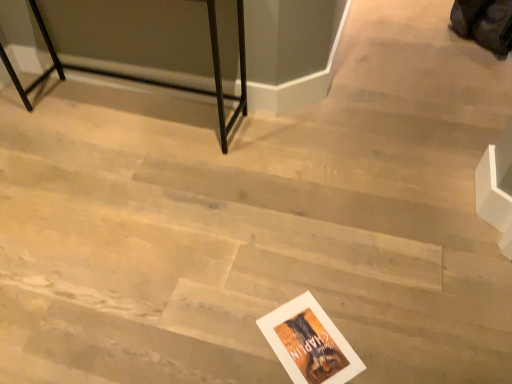
I want to click on white paper postcard at lower center, so click(309, 343).

The height and width of the screenshot is (384, 512). What do you see at coordinates (309, 343) in the screenshot? I see `white paper postcard at lower center` at bounding box center [309, 343].

The image size is (512, 384). Describe the element at coordinates (152, 79) in the screenshot. I see `black metal table at upper left` at that location.

Where is `black metal table at upper left`? black metal table at upper left is located at coordinates 152,79.

Where is `white paper postcard at lower center`? This screenshot has height=384, width=512. white paper postcard at lower center is located at coordinates (309, 343).

Which object is positioned more to the left, white paper postcard at lower center or black metal table at upper left?

black metal table at upper left.

Which object is closer to the camera, white paper postcard at lower center or black metal table at upper left?

white paper postcard at lower center is more forward.

Is point (309, 333) behind point (35, 2)?

No.

From the image's perspective, is white paper postcard at lower center on black metal table at upper left?

No, from the image's perspective, white paper postcard at lower center is not above black metal table at upper left.

From a real-world perspective, between white paper postcard at lower center and black metal table at upper left, who is vertically lower?

In real-world perspective, white paper postcard at lower center is lower.

Between white paper postcard at lower center and black metal table at upper left, which one has larger width?

Wider between the two is black metal table at upper left.

Does white paper postcard at lower center have a greater height compared to black metal table at upper left?

No.

Which of these two, white paper postcard at lower center or black metal table at upper left, is smaller?

white paper postcard at lower center.

Is white paper postcard at lower center completely or partially outside of black metal table at upper left?

Indeed, white paper postcard at lower center is completely outside black metal table at upper left.

Is white paper postcard at lower center not near black metal table at upper left?

Yes, white paper postcard at lower center and black metal table at upper left are quite far apart.

Is white paper postcard at lower center facing towards black metal table at upper left?

No.

How many degrees apart are the facing directions of white paper postcard at lower center and black metal table at upper left?

The angular difference between white paper postcard at lower center and black metal table at upper left is 134 degrees.

Locate an element on the screen. The height and width of the screenshot is (384, 512). postcard on the right of black metal table at upper left is located at coordinates (309, 343).

Consider the image. Considering the relative positions of black metal table at upper left and white paper postcard at lower center in the image provided, is black metal table at upper left to the left of white paper postcard at lower center from the viewer's perspective?

Yes, black metal table at upper left is to the left of white paper postcard at lower center.

Is the position of black metal table at upper left less distant than that of white paper postcard at lower center?

No, black metal table at upper left is behind white paper postcard at lower center.

Does point (209, 12) come farther from viewer compared to point (268, 320)?

Yes, it is behind point (268, 320).

From the image's perspective, which is above, black metal table at upper left or white paper postcard at lower center?

black metal table at upper left is shown above in the image.

From a real-world perspective, is black metal table at upper left physically located above or below white paper postcard at lower center?

In terms of real-world spatial position, black metal table at upper left is above white paper postcard at lower center.

Which of these two, black metal table at upper left or white paper postcard at lower center, is wider?

Wider between the two is black metal table at upper left.

Considering the relative sizes of black metal table at upper left and white paper postcard at lower center in the image provided, is black metal table at upper left shorter than white paper postcard at lower center?

In fact, black metal table at upper left may be taller than white paper postcard at lower center.

Based on their sizes in the image, would you say black metal table at upper left is bigger or smaller than white paper postcard at lower center?

Considering their sizes, black metal table at upper left takes up more space than white paper postcard at lower center.

Would you say black metal table at upper left is outside white paper postcard at lower center?

That's correct, black metal table at upper left is outside of white paper postcard at lower center.

Can you see black metal table at upper left touching white paper postcard at lower center?

There is a gap between black metal table at upper left and white paper postcard at lower center.

Is black metal table at upper left facing towards white paper postcard at lower center?

No, black metal table at upper left is not facing towards white paper postcard at lower center.

How far apart are black metal table at upper left and white paper postcard at lower center?

They are 3.40 feet apart.

Where is `postcard below the black metal table at upper left (from the image's perspective)`? The image size is (512, 384). postcard below the black metal table at upper left (from the image's perspective) is located at coordinates (309, 343).

Find the location of a particular element. The image size is (512, 384). postcard in front of the black metal table at upper left is located at coordinates (309, 343).

Find the location of a particular element. furniture that appears above the white paper postcard at lower center (from a real-world perspective) is located at coordinates (152, 79).